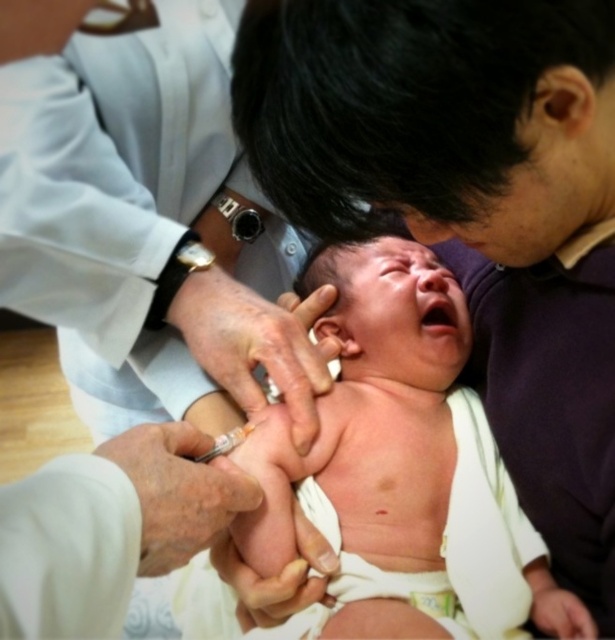
Question: Does white smooth coat at upper left come behind pink smooth skin at center?

Choices:
 (A) yes
 (B) no

Answer: (B)

Question: Where is pink smooth skin at center located in relation to smooth skin hand at center in the image?

Choices:
 (A) right
 (B) left

Answer: (A)

Question: Is white smooth coat at upper left further to the viewer compared to pink smooth skin at center?

Choices:
 (A) yes
 (B) no

Answer: (B)

Question: Estimate the real-world distances between objects in this image. Which object is farther from the white smooth coat at upper left?

Choices:
 (A) white smooth syringe at lower left
 (B) smooth skin hand at center

Answer: (A)

Question: Considering the real-world distances, which object is farthest from the smooth skin hand at center?

Choices:
 (A) white smooth syringe at lower left
 (B) pink smooth skin at center

Answer: (A)

Question: Which object is the farthest from the white smooth coat at upper left?

Choices:
 (A) white smooth syringe at lower left
 (B) pink smooth skin at center

Answer: (A)